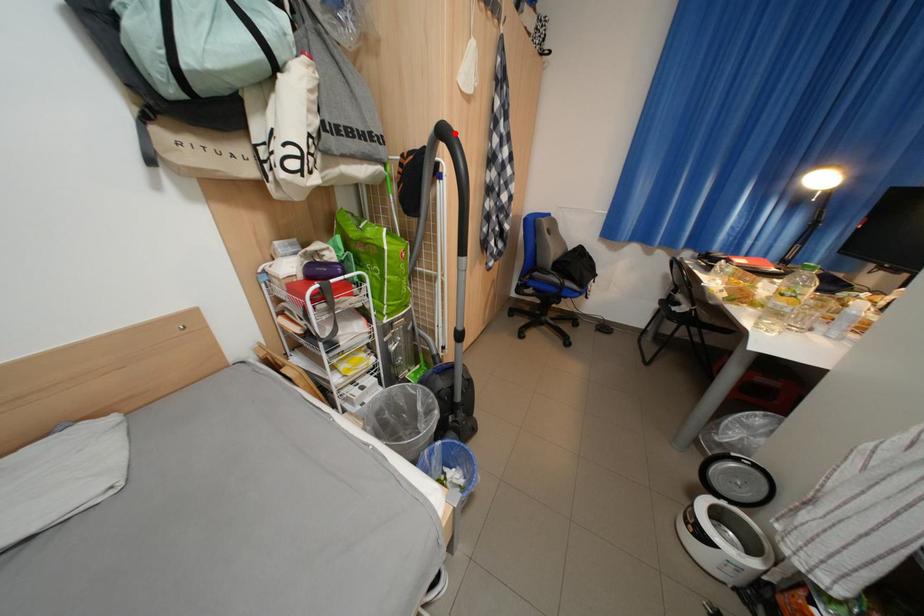
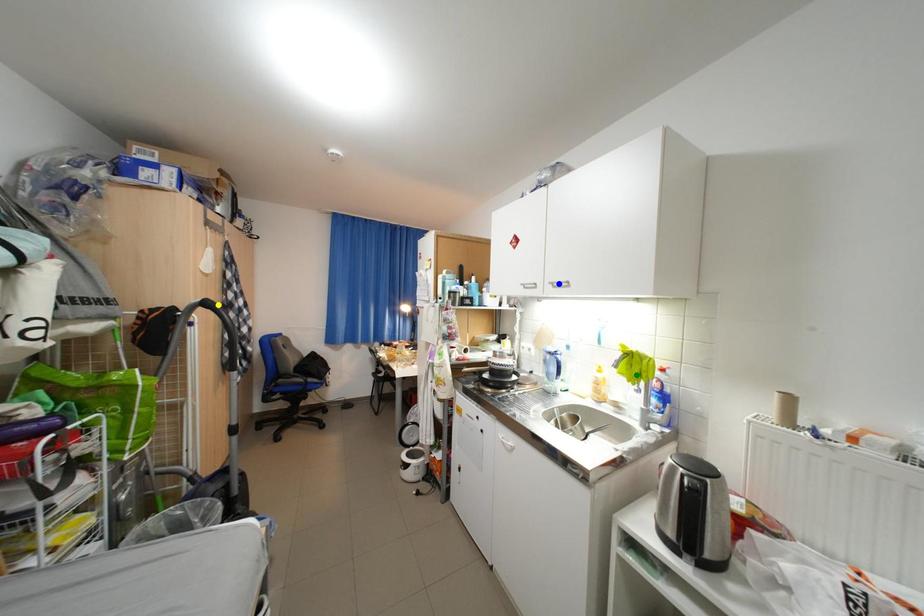
Question: I am providing you with two images of the same scene from different viewpoints. A red point is marked on the first image. You are given multiple points on the second image. Which point in image 2 represents the same 3d spot as the red point in image 1?

Choices:
 (A) blue point
 (B) green point
 (C) yellow point

Answer: (C)